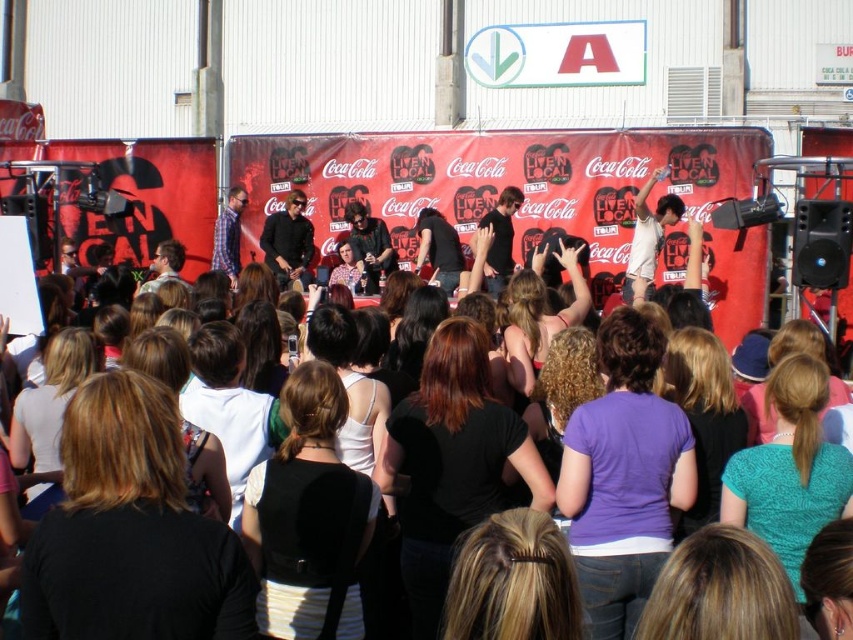
Which of these two, black leather jacket at center or plaid shirt at center, stands taller?

Standing taller between the two is plaid shirt at center.

Describe the element at coordinates (288, 241) in the screenshot. I see `black leather jacket at center` at that location.

Who is more distant from viewer, (305, 236) or (219, 230)?

Positioned behind is point (219, 230).

Identify the location of black leather jacket at center. This screenshot has width=853, height=640. (288, 241).

Is the position of matte black shirt at center less distant than that of plaid shirt at center?

Yes, matte black shirt at center is in front of plaid shirt at center.

Who is more distant from viewer, (x=734, y=449) or (x=238, y=212)?

Positioned behind is point (x=238, y=212).

Where is `matte black shirt at center`? This screenshot has width=853, height=640. matte black shirt at center is located at coordinates (573, 481).

Between matte black shirt at center and black leather jacket at center, which one appears on the right side from the viewer's perspective?

matte black shirt at center is more to the right.

Which is in front, point (584, 500) or point (292, 204)?

Positioned in front is point (584, 500).

The height and width of the screenshot is (640, 853). Identify the location of matte black shirt at center. (573, 481).